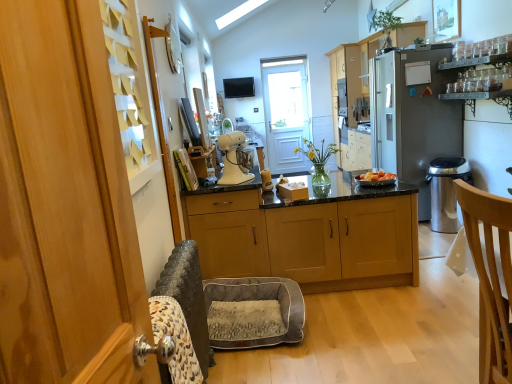
Question: In terms of height, does satin silver refrigerator at right look taller or shorter compared to satin silver trash can at right?

Choices:
 (A) tall
 (B) short

Answer: (A)

Question: In terms of width, does satin silver refrigerator at right look wider or thinner when compared to satin silver trash can at right?

Choices:
 (A) wide
 (B) thin

Answer: (A)

Question: Estimate the real-world distances between objects in this image. Which object is closer to the gray fabric cat bed at lower left?

Choices:
 (A) satin black oven at upper center
 (B) light brown wooden chair at right
 (C) translucent glass vase at center, arranged as the second houseplant when viewed from the top
 (D) white wooden screen door at center
 (E) light wood cabinets at center, marked as the second cabinetry in a front-to-back arrangement

Answer: (C)

Question: Considering the real-world distances, which object is closest to the satin silver trash can at right?

Choices:
 (A) white glossy stand mixer at center
 (B) matte black tv at upper center
 (C) satin silver refrigerator at right
 (D) white wooden screen door at center
 (E) gray fabric cat bed at lower left

Answer: (C)